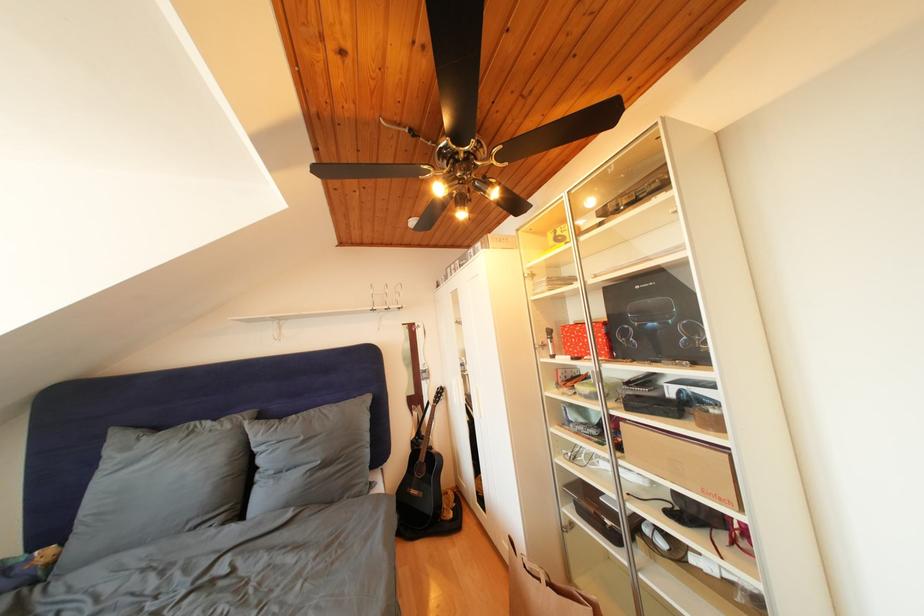
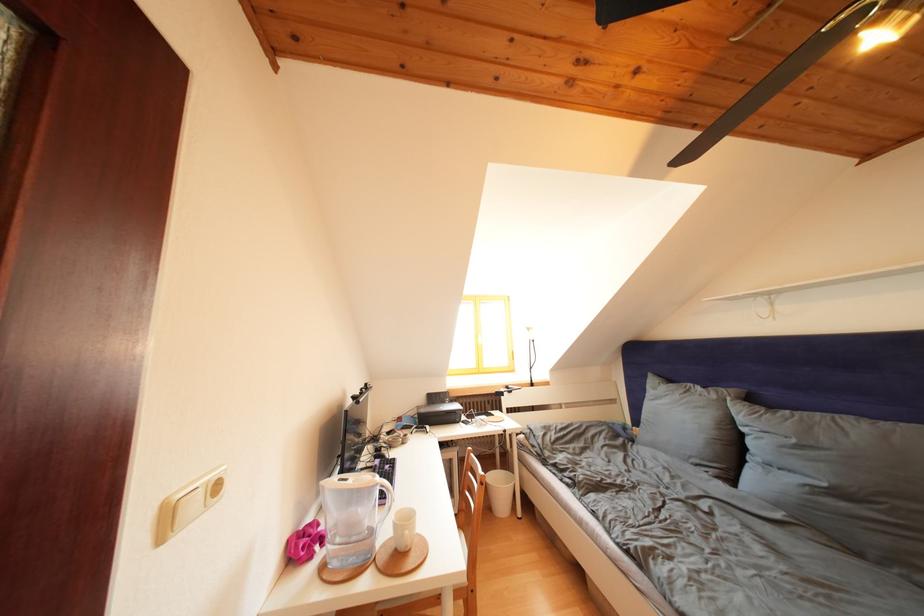
Find the pixel in the second image that matches (x=310, y=444) in the first image.

(801, 446)